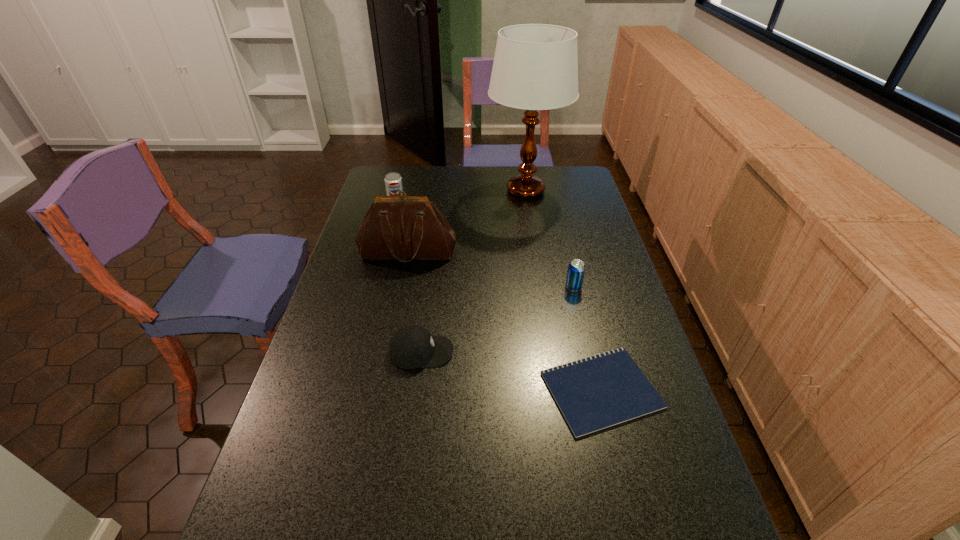
You are a GUI agent. You are given a task and a screenshot of the screen. Output one action in this format:
    pyautogui.click(x=<x>, y=<y>)
    Task: Click on the vacant space situated 0.390m on the right of the fourth shortest object
    The width and height of the screenshot is (960, 540).
    Given the screenshot: What is the action you would take?
    coord(503,205)

The image size is (960, 540). In order to click on vacant region located on the back of the third shortest object in this screenshot , I will do `click(559, 224)`.

Where is `free location located 0.090m on the front-facing side of the second shortest object`? Image resolution: width=960 pixels, height=540 pixels. free location located 0.090m on the front-facing side of the second shortest object is located at coordinates (487, 352).

Locate an element on the screen. The width and height of the screenshot is (960, 540). blank space located on the left of the shortest object is located at coordinates (490, 390).

Where is `object that is at the far edge`? The height and width of the screenshot is (540, 960). object that is at the far edge is located at coordinates (535, 67).

This screenshot has width=960, height=540. In order to click on shoulder bag that is at the left edge in this screenshot , I will do `click(406, 228)`.

Find the location of `soda that is at the left edge`. soda that is at the left edge is located at coordinates coord(393,181).

Where is `table lamp situated at the right edge`? table lamp situated at the right edge is located at coordinates (535, 67).

Image resolution: width=960 pixels, height=540 pixels. In order to click on beer can present at the right edge in this screenshot , I will do `click(576, 269)`.

Locate an element on the screen. The width and height of the screenshot is (960, 540). notepad present at the right edge is located at coordinates (601, 391).